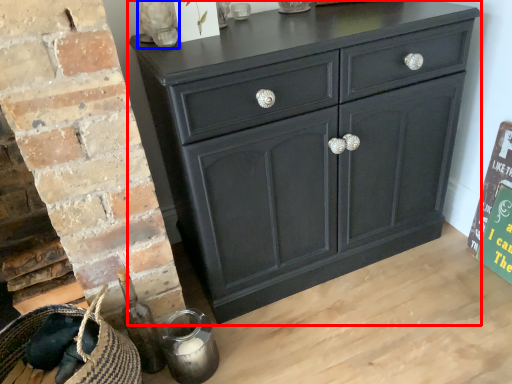
Question: Among these objects, which one is nearest to the camera, chest of drawers (highlighted by a red box) or glass vase (highlighted by a blue box)?

Choices:
 (A) chest of drawers
 (B) glass vase

Answer: (A)